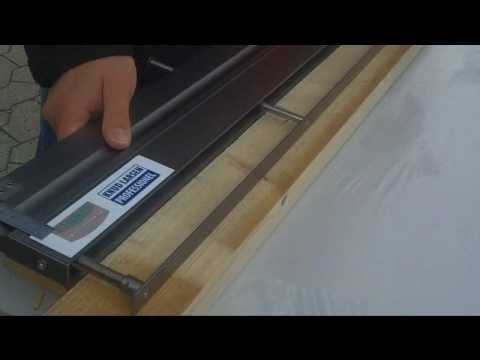
Where is `white table`? This screenshot has height=360, width=480. white table is located at coordinates tap(280, 284).